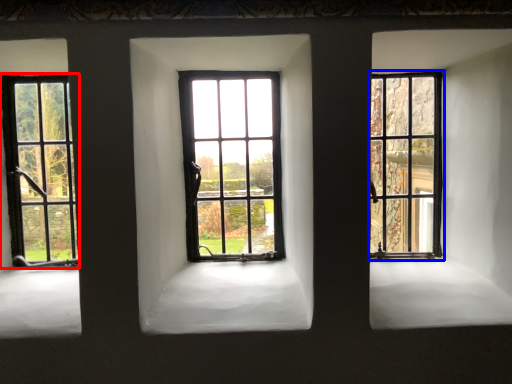
Question: Which point is further to the camera, window (highlighted by a red box) or window (highlighted by a blue box)?

Choices:
 (A) window
 (B) window

Answer: (B)